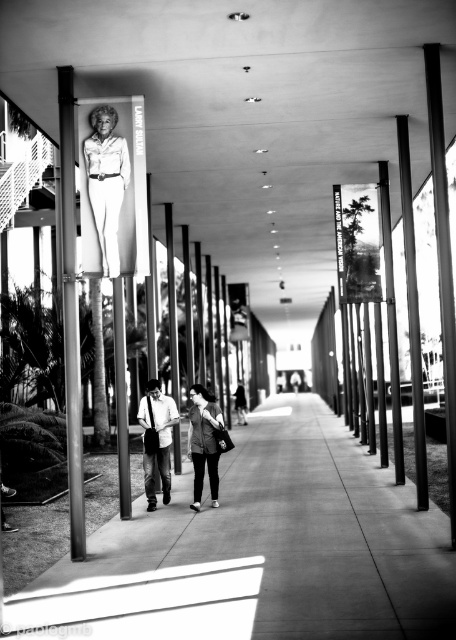
You are standing in the corridor and want to touch both the metallic pole at left and the metallic pole at center. Which pole should you reach for first to touch the closer one?

You should reach for the metallic pole at left first because it is closer to you than the metallic pole at center.

You are an architect designing a new exhibition space. You need to place a 5 feet wide sculpture between the metallic pole at left and the metallic pole at center. Is there enough space for the sculpture?

The distance between the metallic pole at left and metallic pole at center is 6.09 feet, which is wider than the sculpture. Yes, there is enough space for the sculpture.

Looking at this image, you are standing at the entrance of the corridor and see the matte white statue at upper left and the dark gray jacket at center. Which object is closer to you?

The matte white statue at upper left is closer to you because it is in front of the dark gray jacket at center.